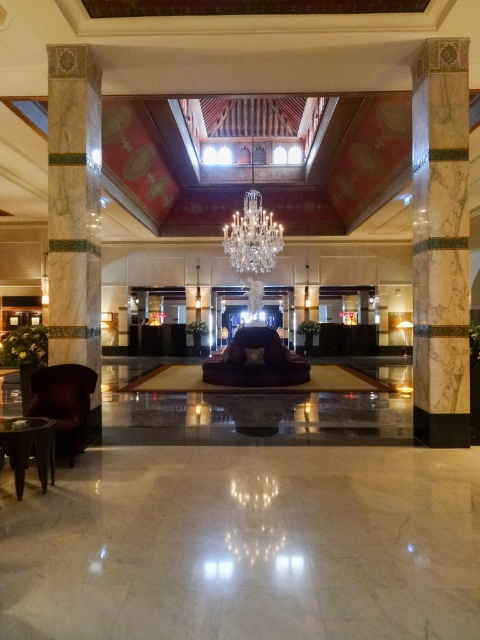
You are standing in the lobby and want to move from the marble column at left to the velvet armchair at left. Which direction should you move?

The marble column at left is to the right of the velvet armchair at left, so you should move to the left to reach the velvet armchair at left.

From the picture: You are standing in the grand lobby and want to take a photo. You notice two points marked in the image. Which point, point (86, 422) or point (264, 211), is closer to your camera lens?

Point (86, 422) is closer to the camera lens than point (264, 211).